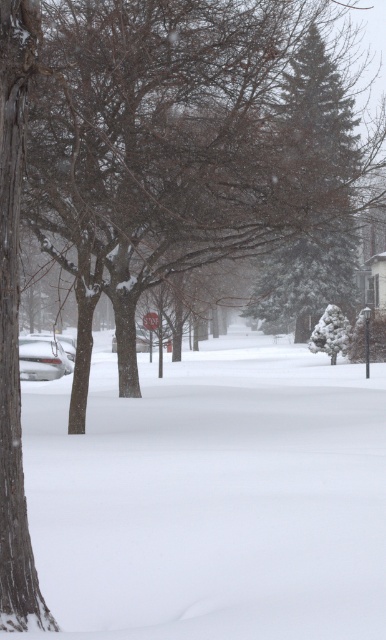
You are standing in the winter scene and want to take a photo of the two points marked in the image. Which point, point (128, 403) or point (291, 109), will appear larger in your camera view?

Point (128, 403) will appear larger in the camera view because it is closer to the camera than point (291, 109).

From the picture: You are a snowplow operator needing to clear the snow from the street. You see the white fluffy snow at center and the green textured pine tree at upper center. Which one has a greater width?

The white fluffy snow at center has a greater width than the green textured pine tree at upper center.